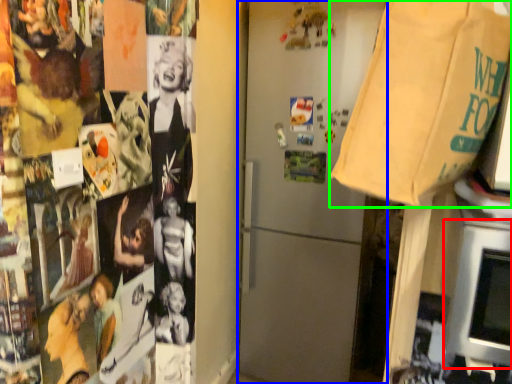
Question: Considering the real-world distances, which object is closest to oven (highlighted by a red box)? refrigerator (highlighted by a blue box) or grocery bag (highlighted by a green box).

Choices:
 (A) refrigerator
 (B) grocery bag

Answer: (B)